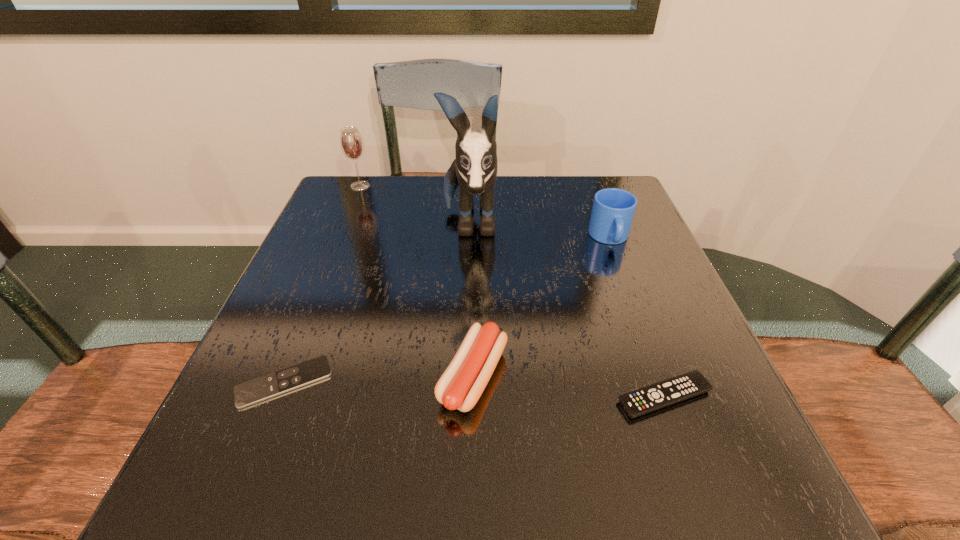
The image size is (960, 540). I want to click on the tallest object, so click(475, 168).

The width and height of the screenshot is (960, 540). What are the coordinates of `the farthest object` in the screenshot? It's located at (352, 146).

Image resolution: width=960 pixels, height=540 pixels. Identify the location of wineglass. (352, 146).

The image size is (960, 540). Identify the location of the third tallest object. (613, 209).

This screenshot has width=960, height=540. Find the location of `the fourth tallest object`. the fourth tallest object is located at coordinates (461, 385).

I want to click on the taller remote control, so click(659, 395).

The image size is (960, 540). What are the coordinates of `the right remote control` in the screenshot? It's located at pos(659,395).

Locate an element on the screen. The image size is (960, 540). the left remote control is located at coordinates (256, 390).

Image resolution: width=960 pixels, height=540 pixels. What are the coordinates of `the shortest object` in the screenshot? It's located at (256, 390).

You are a GUI agent. You are given a task and a screenshot of the screen. Output one action in this format:
    pyautogui.click(x=<x>, y=<y>)
    Task: Click on the vacant space located on the front-facing side of the puppy
    
    Given the screenshot: What is the action you would take?
    pyautogui.click(x=465, y=394)